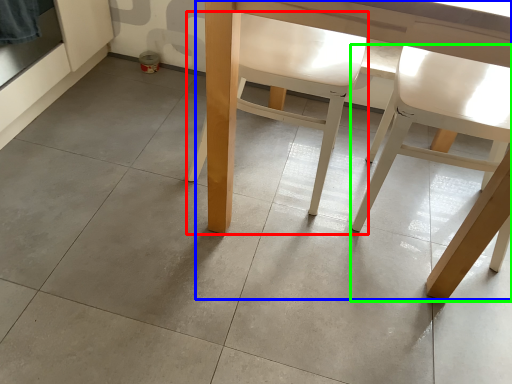
Question: Considering the real-world distances, which object is farthest from chair (highlighted by a red box)? table (highlighted by a blue box) or chair (highlighted by a green box)?

Choices:
 (A) table
 (B) chair

Answer: (B)